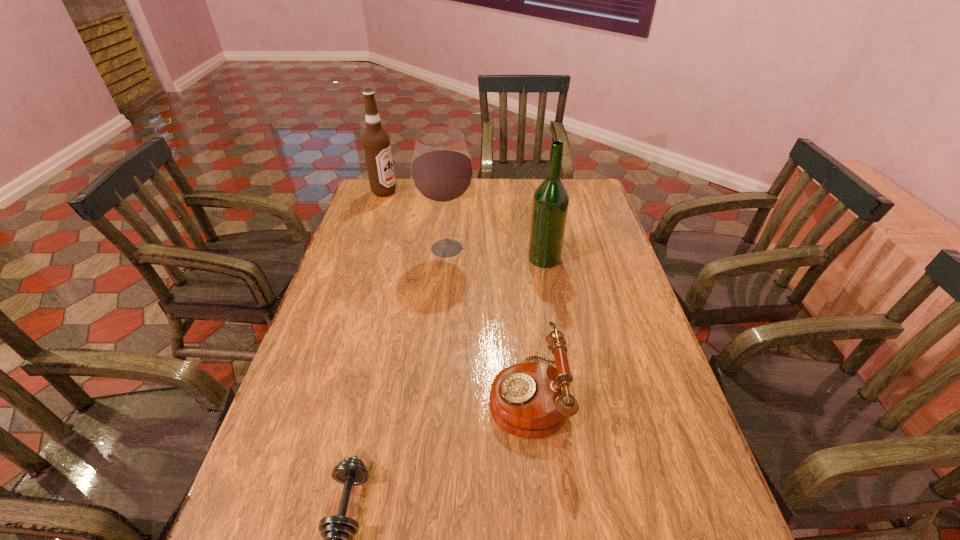
Choose which alcohol is the nearest neighbor to the fourth farthest object. Please provide its 2D coordinates. Your answer should be formatted as a tuple, i.e. [(x, y)], where the tuple contains the x and y coordinates of a point satisfying the conditions above.

[(550, 204)]

Identify the location of free space in the image that satisfies the following two spatial constraints: 1. on the label of the leftmost object; 2. on the back side of the second alcohol from right to left. This screenshot has height=540, width=960. (366, 248).

This screenshot has height=540, width=960. Find the location of `vacant space that satisfies the following two spatial constraints: 1. on the back side of the rightmost alcohol; 2. on the label of the leftmost alcohol`. vacant space that satisfies the following two spatial constraints: 1. on the back side of the rightmost alcohol; 2. on the label of the leftmost alcohol is located at coordinates (533, 192).